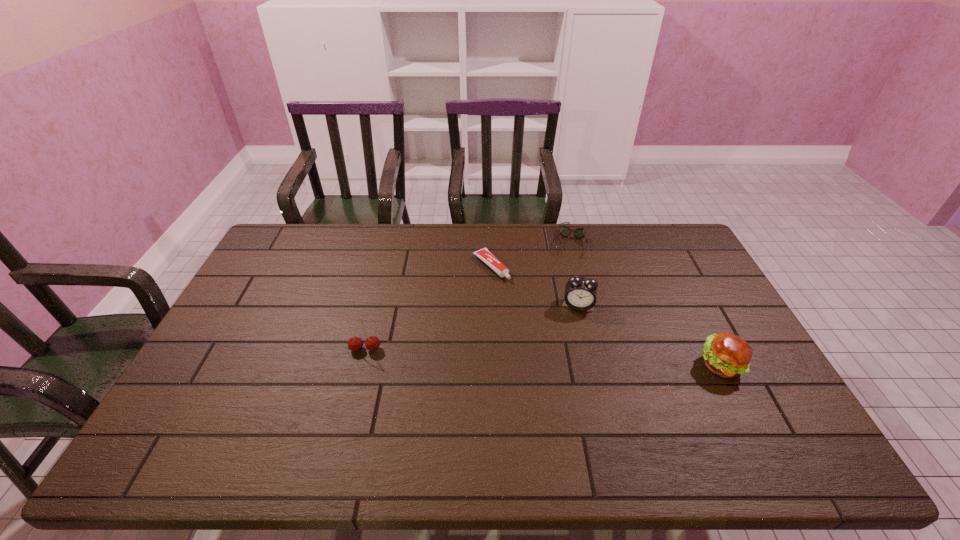
At what (x,y) coordinates should I click in order to perform the action: click on object that is at the right edge. Please return your answer as a coordinate pair (x, y). Image resolution: width=960 pixels, height=540 pixels. Looking at the image, I should click on click(x=728, y=355).

I want to click on vacant region at the far edge, so (x=409, y=230).

Where is `free space at the near edge of the desktop`? The width and height of the screenshot is (960, 540). free space at the near edge of the desktop is located at coordinates (683, 422).

In the image, there is a desktop. At what (x,y) coordinates should I click in order to perform the action: click on vacant space at the left edge. Please return your answer as a coordinate pair (x, y). This screenshot has height=540, width=960. Looking at the image, I should click on (250, 307).

At what (x,y) coordinates should I click in order to perform the action: click on vacant space at the right edge. Please return your answer as a coordinate pair (x, y). The width and height of the screenshot is (960, 540). Looking at the image, I should click on (685, 312).

At what (x,y) coordinates should I click in order to perform the action: click on vacant space that's between the rightmost object and the shortest object. Please return your answer as a coordinate pair (x, y). Looking at the image, I should click on (606, 316).

Where is `free space between the spectacles and the rightmost object`? free space between the spectacles and the rightmost object is located at coordinates (x=645, y=304).

You are a GUI agent. You are given a task and a screenshot of the screen. Output one action in this format:
    pyautogui.click(x=<x>, y=<y>)
    Task: Click on the vacant space in between the fourth object from right to left and the leftmost object
    Image resolution: width=960 pixels, height=540 pixels.
    Given the screenshot: What is the action you would take?
    pyautogui.click(x=428, y=308)

Find the location of a particular element. vacant space in between the second object from left to right and the fourth tallest object is located at coordinates (530, 255).

You are a GUI agent. You are given a task and a screenshot of the screen. Output one action in this format:
    pyautogui.click(x=<x>, y=<y>)
    Task: Click on the free spot between the spectacles and the cherry
    
    Given the screenshot: What is the action you would take?
    pyautogui.click(x=468, y=296)